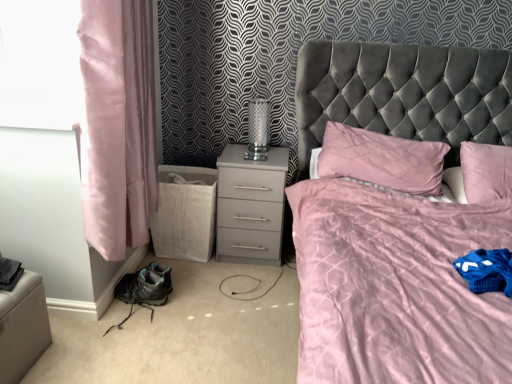
Question: Should I look upward or downward to see velvet grey bed at center?

Choices:
 (A) up
 (B) down

Answer: (B)

Question: Considering the relative sizes of velvet grey bed at center and pink satin curtain at left in the image provided, is velvet grey bed at center taller than pink satin curtain at left?

Choices:
 (A) yes
 (B) no

Answer: (A)

Question: Considering the relative positions of velvet grey bed at center and pink satin curtain at left in the image provided, is velvet grey bed at center in front of pink satin curtain at left?

Choices:
 (A) yes
 (B) no

Answer: (A)

Question: Is velvet grey bed at center oriented towards pink satin curtain at left?

Choices:
 (A) no
 (B) yes

Answer: (A)

Question: Is velvet grey bed at center not near pink satin curtain at left?

Choices:
 (A) yes
 (B) no

Answer: (B)

Question: Is velvet grey bed at center placed right next to pink satin curtain at left?

Choices:
 (A) no
 (B) yes

Answer: (A)

Question: Can you confirm if velvet grey bed at center is wider than pink satin curtain at left?

Choices:
 (A) no
 (B) yes

Answer: (B)

Question: Would you say pink satin pillow at center is outside matte gray nightstand at center?

Choices:
 (A) yes
 (B) no

Answer: (A)

Question: From the image's perspective, is pink satin pillow at center on top of matte gray nightstand at center?

Choices:
 (A) no
 (B) yes

Answer: (B)

Question: Considering the relative sizes of pink satin pillow at center and matte gray nightstand at center in the image provided, is pink satin pillow at center smaller than matte gray nightstand at center?

Choices:
 (A) yes
 (B) no

Answer: (B)

Question: Does pink satin pillow at center contain matte gray nightstand at center?

Choices:
 (A) yes
 (B) no

Answer: (B)

Question: Is the depth of pink satin pillow at center greater than that of matte gray nightstand at center?

Choices:
 (A) no
 (B) yes

Answer: (A)

Question: Does pink satin pillow at center appear on the left side of matte gray nightstand at center?

Choices:
 (A) yes
 (B) no

Answer: (B)

Question: Is velvet grey bed at center placed right next to pink satin pillow at center?

Choices:
 (A) yes
 (B) no

Answer: (B)